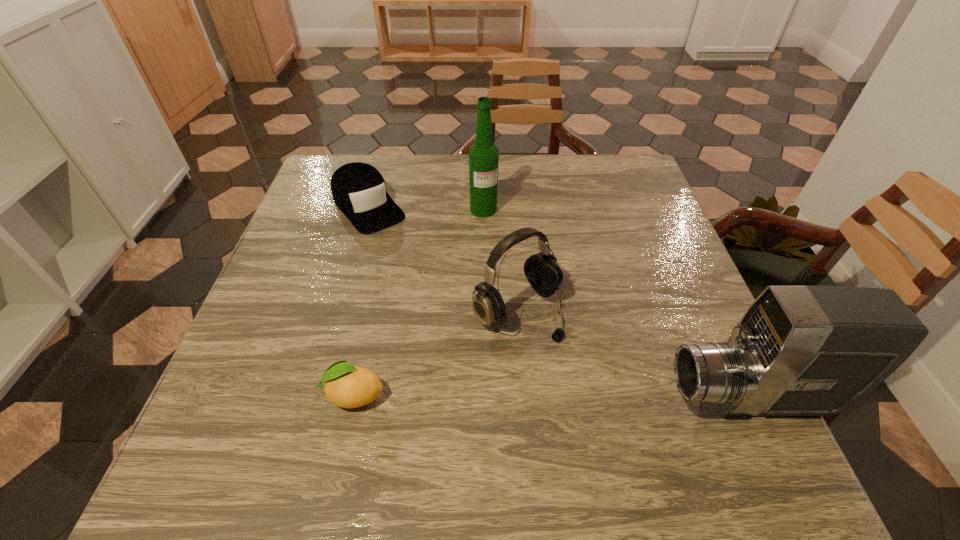
This screenshot has width=960, height=540. Identify the location of free space located 0.180m at the front of the rightmost object, highlighting the lens. (564, 399).

The width and height of the screenshot is (960, 540). I want to click on vacant point located at the front of the rightmost object, highlighting the lens, so click(x=497, y=399).

Where is `free spot located on the label of the beer bottle`? The height and width of the screenshot is (540, 960). free spot located on the label of the beer bottle is located at coordinates (533, 304).

Where is `vacant area located on the label of the beer bottle`? This screenshot has width=960, height=540. vacant area located on the label of the beer bottle is located at coordinates (535, 307).

Image resolution: width=960 pixels, height=540 pixels. What are the coordinates of `free location located on the label of the beer bottle` in the screenshot? It's located at (524, 287).

In order to click on free space located 0.240m on the front-facing side of the cap in this screenshot , I will do `click(435, 286)`.

Find the location of `vacant space located on the front-facing side of the cap`. vacant space located on the front-facing side of the cap is located at coordinates (470, 327).

You are a GUI agent. You are given a task and a screenshot of the screen. Output one action in this format:
    pyautogui.click(x=<x>, y=<y>)
    Task: Click on the vacant space located 0.160m on the front-facing side of the cap
    Image resolution: width=960 pixels, height=540 pixels.
    Given the screenshot: What is the action you would take?
    pyautogui.click(x=417, y=266)

Where is `vacant area situated with the microphone on the side of the headset`? The width and height of the screenshot is (960, 540). vacant area situated with the microphone on the side of the headset is located at coordinates (603, 393).

Where is `free space located with the microphone on the side of the headset`? free space located with the microphone on the side of the headset is located at coordinates (612, 401).